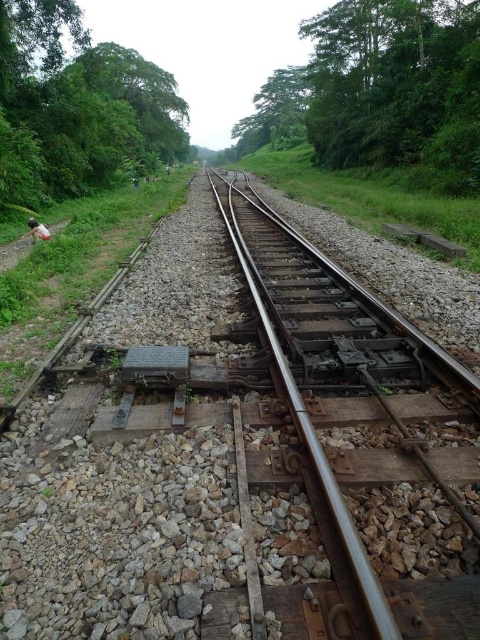
Is point (349, 371) closer to viewer compared to point (37, 224)?

Yes, it is in front of point (37, 224).

Which is more to the left, rusty metal train track at center or white fabric person at left?

From the viewer's perspective, white fabric person at left appears more on the left side.

Describe the element at coordinates (347, 429) in the screenshot. The image size is (480, 640). I see `rusty metal train track at center` at that location.

I want to click on rusty metal train track at center, so [x=347, y=429].